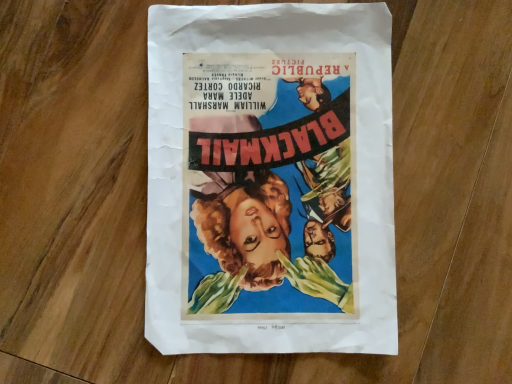
Where is `matte paper poster at center`? matte paper poster at center is located at coordinates (270, 180).

What do you see at coordinates (270, 180) in the screenshot?
I see `matte paper poster at center` at bounding box center [270, 180].

In order to face matte paper poster at center, should I rotate leftwards or rightwards?

Rotate right and turn 1.983 degrees.

The image size is (512, 384). Identify the location of matte paper poster at center. (270, 180).